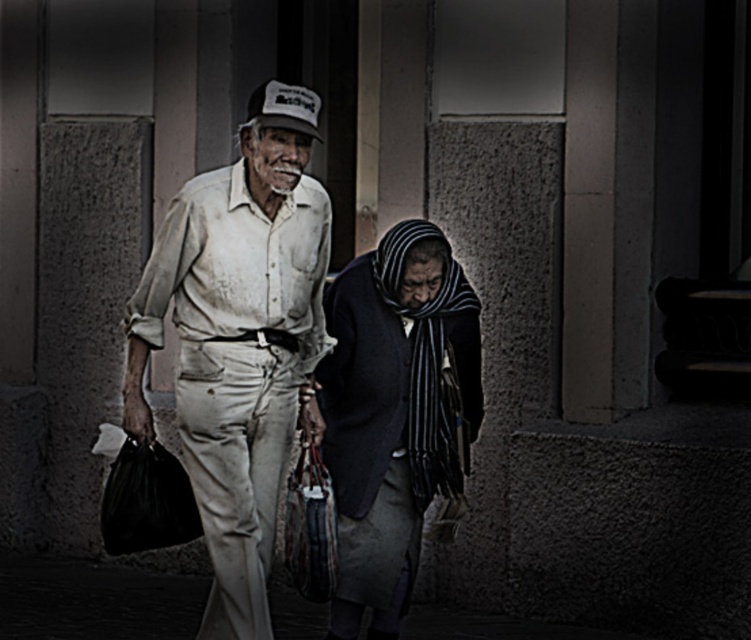
You are a photographer trying to capture a candid shot of the two elderly people walking. You notice the worn beige pants at center and the dark blue woolen scarf at center. Which object should you focus on first to ensure both subjects are in the frame?

The worn beige pants at center is in front of the dark blue woolen scarf at center, so you should focus on the worn beige pants at center first to ensure both subjects are in the frame.

You are a photographer trying to capture a candid shot of the two elderly individuals walking. You want to ensure there is enough space between their clothing items to avoid blurring during the shot. Given that your camera has a minimum focus distance of 18 inches, will the distance between the worn beige pants at center and the dark blue woolen scarf at center allow for a clear photo?

The worn beige pants at center is 18.81 inches from the dark blue woolen scarf at center. Since the minimum focus distance is 18 inches, the distance is sufficient for a clear photo as it exceeds the required 18 inches.